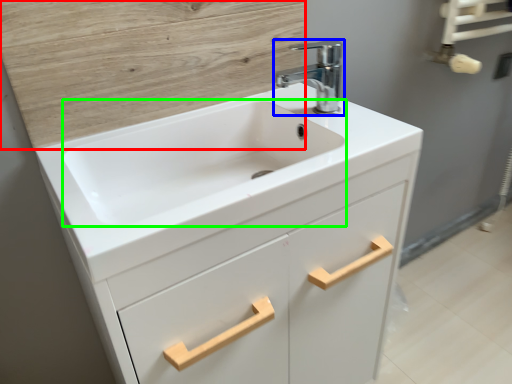
Question: Based on their relative distances, which object is farther from plywood (highlighted by a red box)? Choose from tap (highlighted by a blue box) and sink (highlighted by a green box).

Choices:
 (A) tap
 (B) sink

Answer: (A)